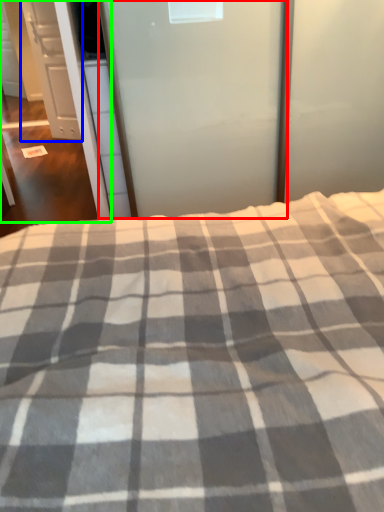
Question: Based on their relative distances, which object is nearer to screen door (highlighted by a red box)? Choose from cabinetry (highlighted by a blue box) and screen door (highlighted by a green box).

Choices:
 (A) cabinetry
 (B) screen door

Answer: (B)